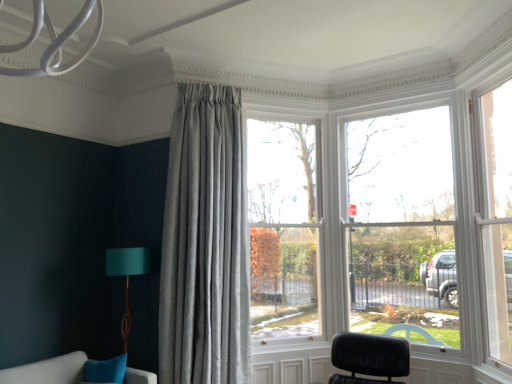
Question: Does point (242, 263) appear closer or farther from the camera than point (123, 340)?

Choices:
 (A) closer
 (B) farther

Answer: (B)

Question: From a real-world perspective, is satin grey curtain at center above or below teal fabric lampshade at lower left?

Choices:
 (A) above
 (B) below

Answer: (A)

Question: Estimate the real-world distances between objects in this image. Which object is closer to the satin grey curtain at center?

Choices:
 (A) clear glass window at center
 (B) teal fabric lampshade at lower left

Answer: (A)

Question: Which object is positioned closest to the clear glass window at center?

Choices:
 (A) satin grey curtain at center
 (B) teal fabric lampshade at lower left

Answer: (A)